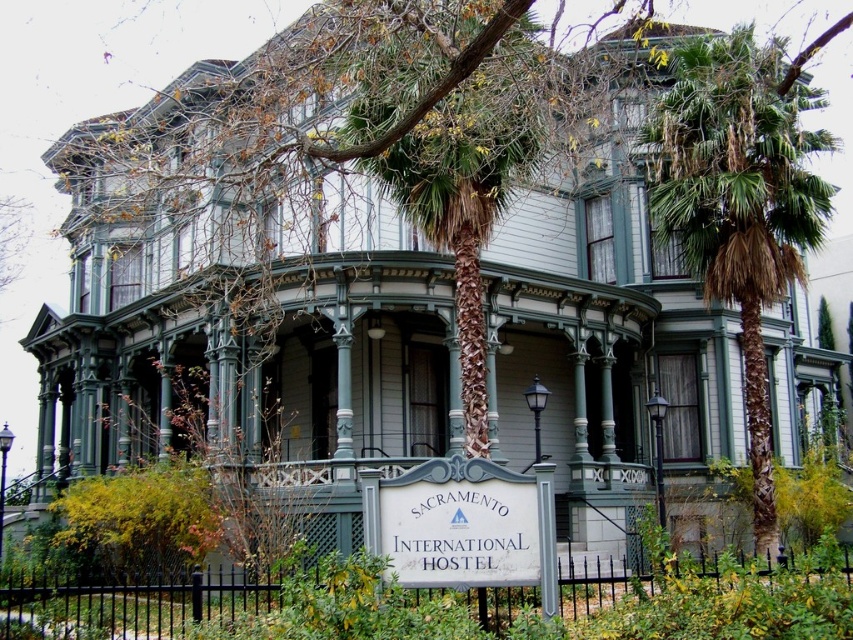
Is green leafy palm tree at right to the right of white wood sign at center from the viewer's perspective?

Yes, green leafy palm tree at right is to the right of white wood sign at center.

Is green leafy palm tree at right wider than white wood sign at center?

Correct, the width of green leafy palm tree at right exceeds that of white wood sign at center.

Which is behind, point (717, 45) or point (544, 570)?

The point (717, 45) is more distant.

Locate an element on the screen. The height and width of the screenshot is (640, 853). green leafy palm tree at right is located at coordinates (740, 200).

From the picture: Can you confirm if green textured palm tree at center is taller than white wood sign at center?

Yes.

Who is more forward, (467, 317) or (413, 525)?

Point (413, 525) is in front.

Is point (541, 157) farther from viewer compared to point (471, 580)?

That is True.

The width and height of the screenshot is (853, 640). I want to click on green textured palm tree at center, so click(x=463, y=160).

Can you confirm if green leafy palm tree at right is taller than green textured palm tree at center?

Yes.

Is green leafy palm tree at right below green textured palm tree at center?

Correct, green leafy palm tree at right is located below green textured palm tree at center.

Measure the distance between point (x=752, y=198) and camera.

60.36 meters

Identify the location of green leafy palm tree at right. The image size is (853, 640). (740, 200).